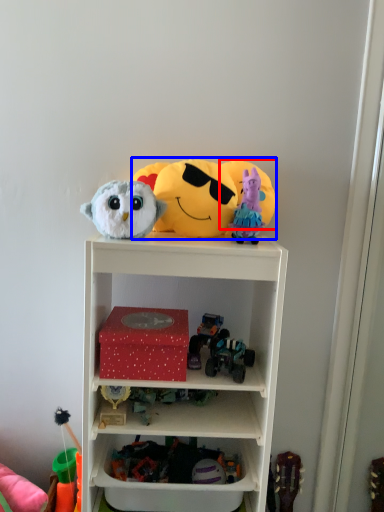
Question: Which point is closer to the camera, toy (highlighted by a red box) or toy (highlighted by a blue box)?

Choices:
 (A) toy
 (B) toy

Answer: (B)